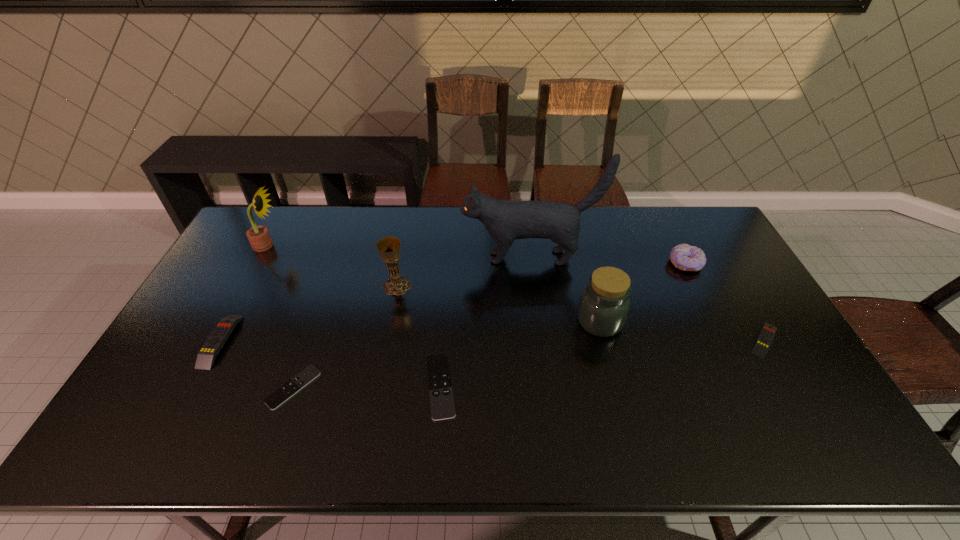
I want to click on object that is the closest to the left black remote control, so click(x=206, y=356).

Choose which remote control is the second nearest neighbor to the gold chalice. Please provide its 2D coordinates. Your answer should be formatted as a tuple, i.e. [(x, y)], where the tuple contains the x and y coordinates of a point satisfying the conditions above.

[(286, 391)]

At what (x,y) coordinates should I click in order to perform the action: click on the second closest remote control to the right yellow remote control. Please return your answer as a coordinate pair (x, y). This screenshot has height=540, width=960. Looking at the image, I should click on (286, 391).

Image resolution: width=960 pixels, height=540 pixels. Identify the location of free space that satisfies the following two spatial constraints: 1. at the face of the gray cat; 2. on the front side of the bigger yellow remote control. (540, 341).

At what (x,y) coordinates should I click in order to perform the action: click on vacant area in the image that satisfies the following two spatial constraints: 1. on the face of the gold chalice; 2. on the left side of the second tallest object. Please return your answer as a coordinate pair (x, y). The image size is (960, 540). Looking at the image, I should click on (246, 286).

Locate an element on the screen. This screenshot has width=960, height=540. vacant region that satisfies the following two spatial constraints: 1. on the face of the brown doughnut; 2. on the left side of the yellow sunflower is located at coordinates (257, 264).

Where is `vacant region that satisfies the following two spatial constraints: 1. on the face of the yellow sunflower; 2. on the back side of the fourth shortest object`? This screenshot has width=960, height=540. vacant region that satisfies the following two spatial constraints: 1. on the face of the yellow sunflower; 2. on the back side of the fourth shortest object is located at coordinates (216, 341).

Identify the location of free location that satisfies the following two spatial constraints: 1. on the face of the second remote control from right to left; 2. on the left side of the yellow sunflower. This screenshot has width=960, height=540. (191, 387).

The image size is (960, 540). I want to click on vacant space that satisfies the following two spatial constraints: 1. on the face of the second tallest object; 2. on the right side of the green jar, so click(x=227, y=321).

This screenshot has height=540, width=960. I want to click on vacant region that satisfies the following two spatial constraints: 1. on the back side of the jar; 2. on the face of the yellow sunflower, so click(x=581, y=246).